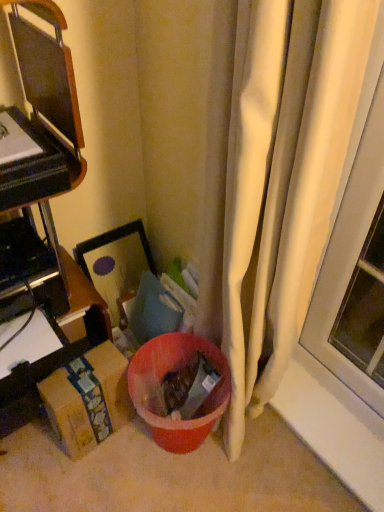
Question: Is brown cardboard box at left, the 1th furniture viewed from the top, not inside brown cardboard box at lower left?

Choices:
 (A) no
 (B) yes

Answer: (B)

Question: Is brown cardboard box at left, the 1th furniture viewed from the top, far from brown cardboard box at lower left?

Choices:
 (A) no
 (B) yes

Answer: (A)

Question: Is brown cardboard box at left, the 1th furniture viewed from the top, positioned with its back to brown cardboard box at lower left?

Choices:
 (A) yes
 (B) no

Answer: (B)

Question: Are brown cardboard box at left, the second furniture ordered from the bottom, and brown cardboard box at lower left making contact?

Choices:
 (A) no
 (B) yes

Answer: (A)

Question: Is the depth of brown cardboard box at left, the second furniture ordered from the bottom, greater than that of brown cardboard box at lower left?

Choices:
 (A) yes
 (B) no

Answer: (B)

Question: Does brown cardboard box at left, the 1th furniture viewed from the top, have a smaller size compared to brown cardboard box at lower left?

Choices:
 (A) no
 (B) yes

Answer: (A)

Question: Can you confirm if brown cardboard box at lower left is thinner than brown cardboard box at left, which ranks as the 2th furniture in top-to-bottom order?

Choices:
 (A) yes
 (B) no

Answer: (A)

Question: Considering the relative sizes of brown cardboard box at lower left and brown cardboard box at left, which ranks as the 2th furniture in top-to-bottom order, in the image provided, is brown cardboard box at lower left shorter than brown cardboard box at left, which ranks as the 2th furniture in top-to-bottom order,?

Choices:
 (A) yes
 (B) no

Answer: (B)

Question: Is brown cardboard box at left, which is the first furniture in bottom-to-top order, surrounded by brown cardboard box at lower left?

Choices:
 (A) no
 (B) yes

Answer: (A)

Question: Is brown cardboard box at lower left outside of brown cardboard box at left, which ranks as the 2th furniture in top-to-bottom order?

Choices:
 (A) no
 (B) yes

Answer: (B)

Question: From a real-world perspective, is brown cardboard box at lower left located higher than brown cardboard box at left, which is the first furniture in bottom-to-top order?

Choices:
 (A) yes
 (B) no

Answer: (A)

Question: Can you confirm if brown cardboard box at lower left is bigger than brown cardboard box at left, which is the first furniture in bottom-to-top order?

Choices:
 (A) yes
 (B) no

Answer: (B)

Question: Is white fabric curtain at right looking in the opposite direction of brown cardboard box at left, which is the first furniture in bottom-to-top order?

Choices:
 (A) no
 (B) yes

Answer: (A)